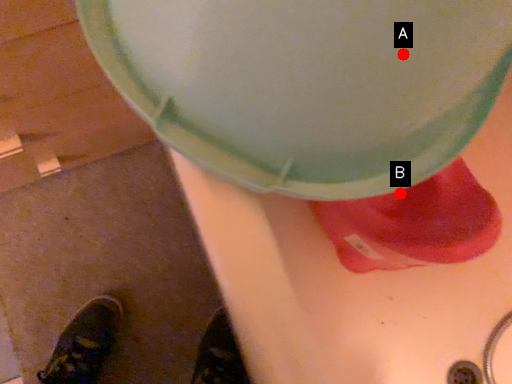
Question: Two points are circled on the image, labeled by A and B beside each circle. Which of the following is the closest to the observer?

Choices:
 (A) A is closer
 (B) B is closer

Answer: (A)